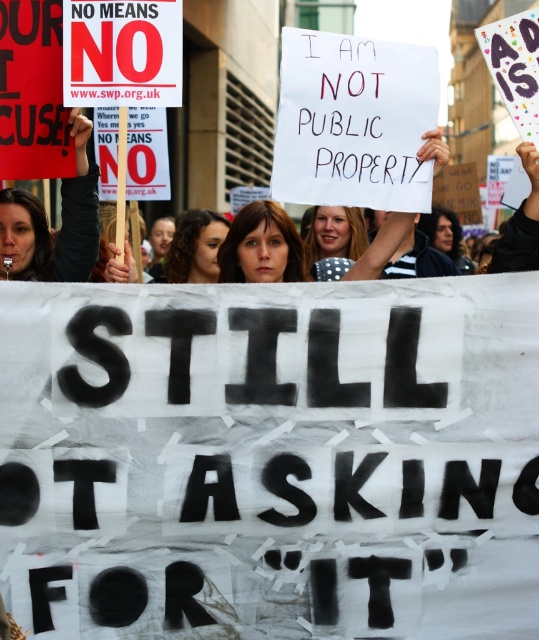
You are a photographer trying to capture the protest scene. You want to ensure both the matte black sign at center and the white paper sign at center are clearly visible in your photo. Given their sizes, which sign should you focus on to ensure both are in frame without needing to zoom in or out?

The matte black sign at center is bigger than the white paper sign at center, so focusing on the matte black sign at center will ensure both signs are in frame without needing to adjust the zoom since it takes up more space and can serve as a reference point.

You are a photographer trying to capture the protest scene. You notice the white paper at center and the matte brown hair at center. Which object should you focus on to ensure it appears larger in your photo?

The white paper at center is closer to the viewer than the matte brown hair at center, so focusing on the white paper at center will make it appear larger in the photo.

You are a photographer trying to capture the protest scene. You notice two points of interest marked as point 1 at coordinates point (299, 108) and point 2 at coordinates point (264, 230). Which point is closer to the camera?

Point 1 at coordinates point (299, 108) is closer to the camera because it is in front of point 2 at coordinates point (264, 230).